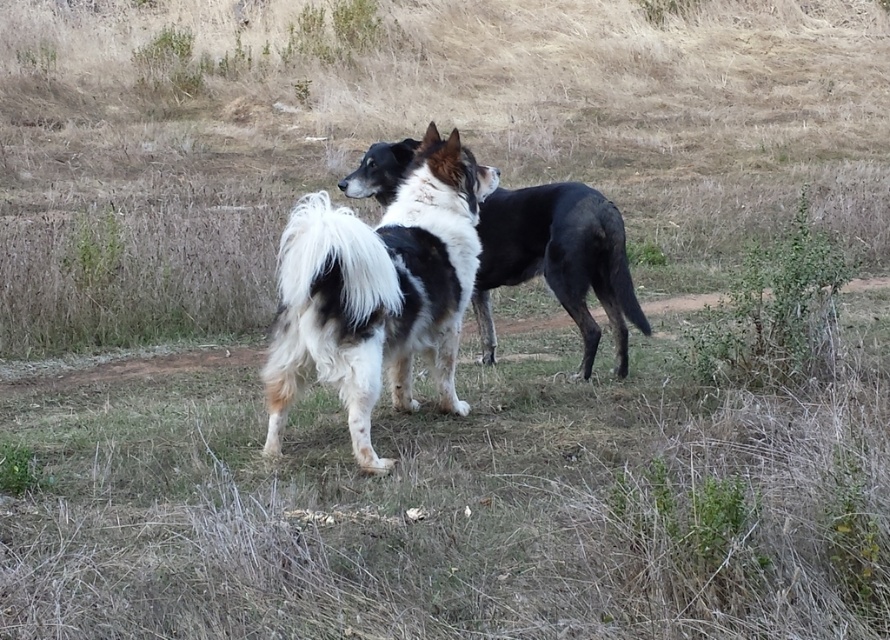
Question: Among these objects, which one is farthest from the camera?

Choices:
 (A) black and white fur dog at center
 (B) brown dry grass at center

Answer: (A)

Question: Does brown dry grass at center have a smaller size compared to white fluffy dog at center?

Choices:
 (A) no
 (B) yes

Answer: (A)

Question: Where is brown dry grass at center located in relation to white fluffy dog at center in the image?

Choices:
 (A) left
 (B) right

Answer: (B)

Question: Can you confirm if white fluffy dog at center is positioned above black and white fur dog at center?

Choices:
 (A) yes
 (B) no

Answer: (B)

Question: Which point is closer to the camera?

Choices:
 (A) (450, 385)
 (B) (75, 577)

Answer: (B)

Question: Which object appears farthest from the camera in this image?

Choices:
 (A) black and white fur dog at center
 (B) brown dry grass at center
 (C) white fluffy dog at center

Answer: (A)